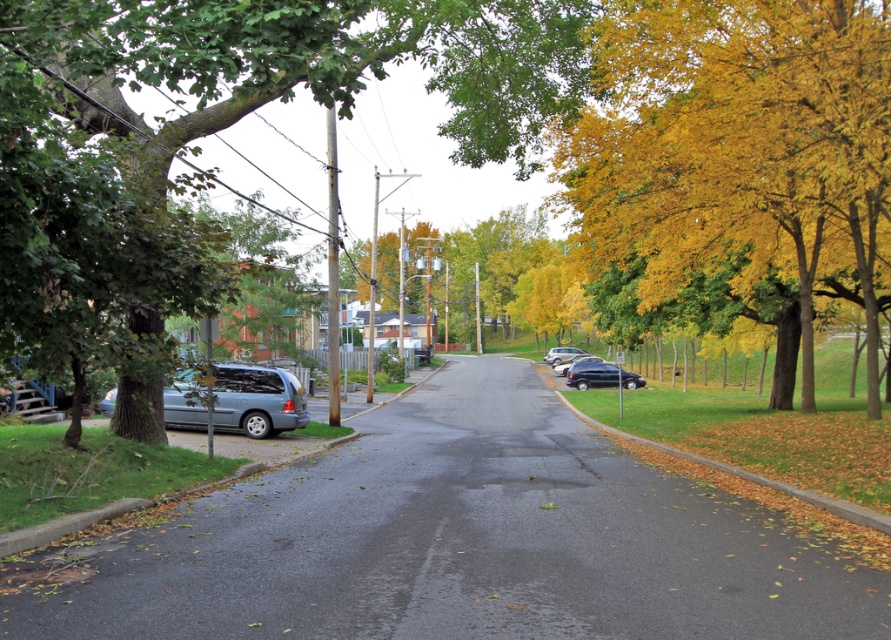
Is yellow leafy tree at center shorter than shiny black sedan at center?

Incorrect, yellow leafy tree at center's height does not fall short of shiny black sedan at center's.

Is yellow leafy tree at center below shiny black sedan at center?

No.

What are the coordinates of `yellow leafy tree at center` in the screenshot? It's located at (503, 272).

What do you see at coordinates (601, 376) in the screenshot? I see `glossy black suv at center-right` at bounding box center [601, 376].

This screenshot has height=640, width=891. I want to click on glossy black suv at center-right, so click(x=601, y=376).

Image resolution: width=891 pixels, height=640 pixels. I want to click on glossy black suv at center-right, so click(x=601, y=376).

Based on the photo, does yellow/golden leaves at right appear on the right side of yellow leafy tree at center?

Correct, you'll find yellow/golden leaves at right to the right of yellow leafy tree at center.

Is point (648, 84) behind point (489, 301)?

No.

Measure the distance between yellow/golden leaves at right and camera.

The distance of yellow/golden leaves at right from camera is 12.95 meters.

The image size is (891, 640). In order to click on yellow/golden leaves at right in this screenshot , I will do (x=738, y=148).